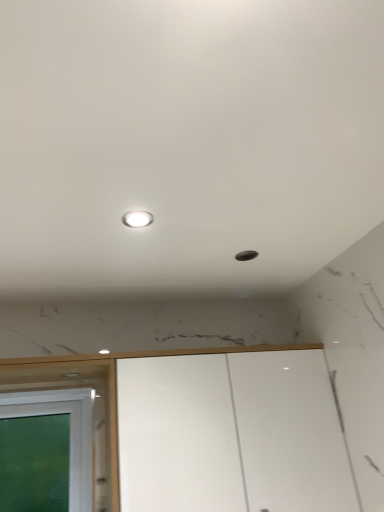
What are the coordinates of `white glossy light at upper center` in the screenshot? It's located at (137, 219).

From a real-world perspective, relative to white glossy light at upper center, is white glossy cabinet at lower center vertically above or below?

From a real-world perspective, white glossy cabinet at lower center is physically below white glossy light at upper center.

How distant is white glossy cabinet at lower center from white glossy light at upper center?

They are 30.76 inches apart.

This screenshot has width=384, height=512. I want to click on light located on the left of white glossy cabinet at lower center, so [137, 219].

Choose the correct answer: Is white glossy cabinet at lower center inside white glossy light at upper center or outside it?

The correct answer is: outside.

Can we say white glossy light at upper center lies outside white glossy cabinet at lower center?

Yes, white glossy light at upper center is outside of white glossy cabinet at lower center.

Can you confirm if white glossy light at upper center is positioned to the right of white glossy cabinet at lower center?

No.

Which object is closer to the camera taking this photo, white glossy light at upper center or white glossy cabinet at lower center?

Positioned in front is white glossy light at upper center.

Image resolution: width=384 pixels, height=512 pixels. Identify the location of cabinetry that is below the white glossy light at upper center (from the image's perspective). (231, 434).

From their relative heights in the image, would you say green glass window at lower left is taller or shorter than white glossy light at upper center?

In the image, green glass window at lower left appears to be taller than white glossy light at upper center.

Is green glass window at lower left facing towards white glossy light at upper center?

Yes.

From a real-world perspective, between green glass window at lower left and white glossy light at upper center, who is vertically lower?

From a 3D spatial view, green glass window at lower left is below.

Is white glossy cabinet at lower center further to the viewer compared to green glass window at lower left?

No, it is not.

Which object is wider, white glossy cabinet at lower center or green glass window at lower left?

With larger width is white glossy cabinet at lower center.

In the image, is white glossy cabinet at lower center on the left side or the right side of green glass window at lower left?

white glossy cabinet at lower center is positioned on green glass window at lower left's right side.

Considering the sizes of objects white glossy cabinet at lower center and green glass window at lower left in the image provided, who is taller, white glossy cabinet at lower center or green glass window at lower left?

white glossy cabinet at lower center is taller.

Is green glass window at lower left outside of white glossy cabinet at lower center?

green glass window at lower left is positioned outside white glossy cabinet at lower center.

Is point (81, 435) farther from viewer compared to point (124, 378)?

Yes, it is behind point (124, 378).

Considering the relative sizes of green glass window at lower left and white glossy cabinet at lower center in the image provided, is green glass window at lower left shorter than white glossy cabinet at lower center?

Yes, green glass window at lower left is shorter than white glossy cabinet at lower center.

Is white glossy light at upper center in contact with green glass window at lower left?

No, white glossy light at upper center is not making contact with green glass window at lower left.

From a real-world perspective, which object stands above the other?

From a 3D spatial view, white glossy light at upper center is above.

Can you confirm if white glossy light at upper center is bigger than green glass window at lower left?

Incorrect, white glossy light at upper center is not larger than green glass window at lower left.

Is white glossy light at upper center facing towards green glass window at lower left?

No, white glossy light at upper center does not turn towards green glass window at lower left.

Where is `cabinetry on the right side of white glossy light at upper center`? The image size is (384, 512). cabinetry on the right side of white glossy light at upper center is located at coordinates (231, 434).

Find the location of a particular element. The image size is (384, 512). cabinetry that appears below the white glossy light at upper center (from the image's perspective) is located at coordinates (231, 434).

Based on their spatial positions, is green glass window at lower left or white glossy light at upper center closer to white glossy cabinet at lower center?

Based on the image, green glass window at lower left appears to be nearer to white glossy cabinet at lower center.

Considering their positions, is white glossy cabinet at lower center positioned closer to green glass window at lower left than white glossy light at upper center?

Among the two, white glossy cabinet at lower center is located nearer to green glass window at lower left.

Which object lies further to the anchor point white glossy cabinet at lower center, white glossy light at upper center or green glass window at lower left?

The object further to white glossy cabinet at lower center is white glossy light at upper center.

Considering their positions, is green glass window at lower left positioned closer to white glossy light at upper center than white glossy cabinet at lower center?

Based on the image, white glossy cabinet at lower center appears to be nearer to white glossy light at upper center.

Which object lies nearer to the anchor point white glossy light at upper center, white glossy cabinet at lower center or green glass window at lower left?

white glossy cabinet at lower center lies closer to white glossy light at upper center than the other object.

Based on their spatial positions, is white glossy light at upper center or white glossy cabinet at lower center further from green glass window at lower left?

white glossy light at upper center lies further to green glass window at lower left than the other object.

Identify the location of cabinetry between white glossy light at upper center and green glass window at lower left in the vertical direction. [231, 434].